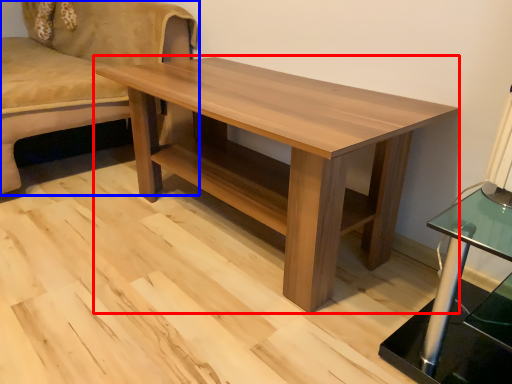
Question: Which point is further to the camera, coffee table (highlighted by a red box) or studio couch (highlighted by a blue box)?

Choices:
 (A) coffee table
 (B) studio couch

Answer: (B)